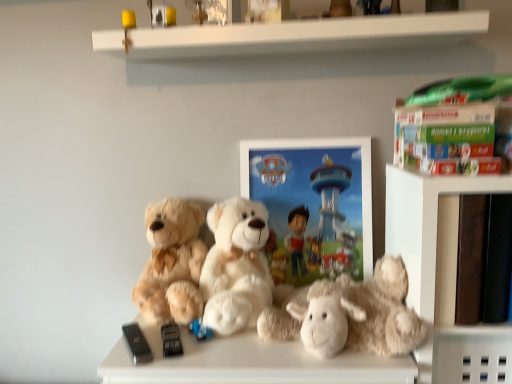
Question: Would you say metallic silver toy at upper center, acting as the first toy starting from the top, is to the left or to the right of fuzzy beige teddy bear at left, arranged as the third teddy bear when viewed from the right, in the picture?

Choices:
 (A) left
 (B) right

Answer: (B)

Question: In terms of width, does metallic silver toy at upper center, acting as the first toy starting from the top, look wider or thinner when compared to fuzzy beige teddy bear at left, the first teddy bear in the left-to-right sequence?

Choices:
 (A) thin
 (B) wide

Answer: (A)

Question: Which is nearer to the green cardboard book at upper right?

Choices:
 (A) fluffy white teddy bear at center, acting as the third teddy bear starting from the left
 (B) black matte remote control at lower left, the 3th toy when ordered from top to bottom
 (C) fuzzy beige teddy bear at left, arranged as the third teddy bear when viewed from the right
 (D) black plastic remote at center, the 2th toy in the bottom-to-top sequence
 (E) smooth brown bookshelf at right

Answer: (E)

Question: Which object is the closest to the green cardboard book at upper right?

Choices:
 (A) black plastic remote at center, the 2th toy in the bottom-to-top sequence
 (B) black matte remote control at lower left, the 1th toy from the bottom
 (C) metallic silver toy at upper center, which appears as the third toy when ordered from the bottom
 (D) smooth brown bookshelf at right
 (E) matte plastic picture frame at center

Answer: (D)